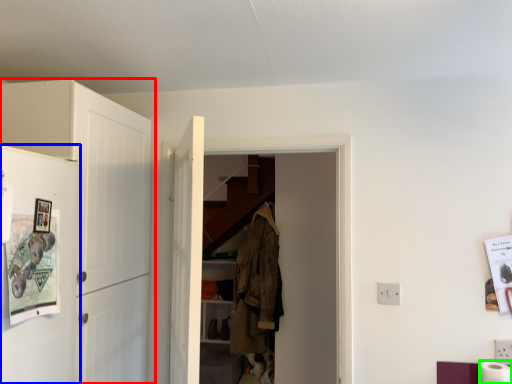
Question: Estimate the real-world distances between objects in this image. Which object is closer to cabinetry (highlighted by a red box), fridge (highlighted by a blue box) or toilet paper (highlighted by a green box)?

Choices:
 (A) fridge
 (B) toilet paper

Answer: (A)